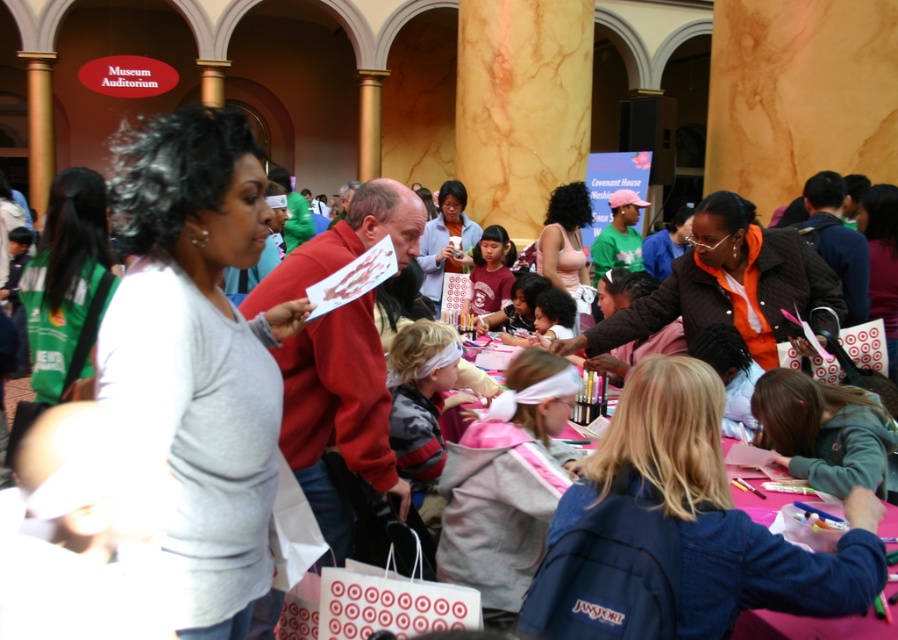
Question: Is green fabric bag at left to the left of pink matte tank top at center from the viewer's perspective?

Choices:
 (A) no
 (B) yes

Answer: (B)

Question: Which of these objects is positioned farthest from the gray matte sweater at center?

Choices:
 (A) pink matte tank top at center
 (B) orange fabric jacket at center
 (C) striped fleece jacket at center
 (D) denim jacket at lower right

Answer: (A)

Question: From the image, what is the correct spatial relationship of green fabric bag at left in relation to striped fleece jacket at center?

Choices:
 (A) left
 (B) right

Answer: (A)

Question: Among these objects, which one is farthest from the camera?

Choices:
 (A) green fabric bag at left
 (B) pink matte tank top at center
 (C) striped fleece jacket at center

Answer: (B)

Question: Which of the following is the closest to the observer?

Choices:
 (A) gray matte sweater at center
 (B) matte white shirt at center
 (C) orange fabric jacket at center
 (D) striped fleece jacket at center

Answer: (A)

Question: Is gray matte sweater at center in front of denim jacket at lower right?

Choices:
 (A) yes
 (B) no

Answer: (B)